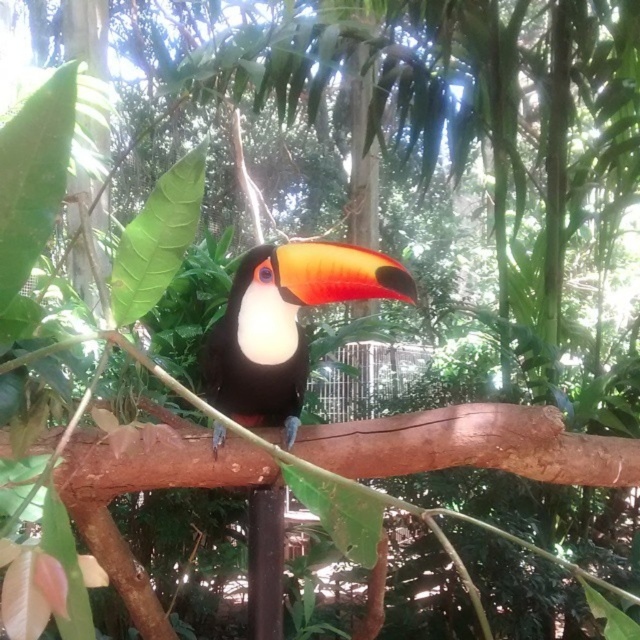
Question: Which of the following is the farthest from the observer?

Choices:
 (A) shiny black toucan at center
 (B) brown rough tree branch at center

Answer: (A)

Question: Is brown rough tree branch at center above shiny black toucan at center?

Choices:
 (A) no
 (B) yes

Answer: (A)

Question: Is brown rough tree branch at center further to camera compared to shiny black toucan at center?

Choices:
 (A) no
 (B) yes

Answer: (A)

Question: Does brown rough tree branch at center appear on the left side of shiny black toucan at center?

Choices:
 (A) no
 (B) yes

Answer: (A)

Question: Which of the following is the closest to the observer?

Choices:
 (A) shiny black toucan at center
 (B) brown rough tree branch at center

Answer: (B)

Question: Which of the following is the farthest from the observer?

Choices:
 (A) (163, 445)
 (B) (216, 387)

Answer: (B)